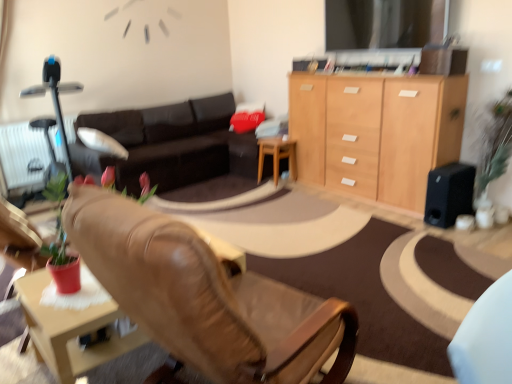
At what (x,y) coordinates should I click in order to perform the action: click on free space to the left of black matte speaker at right. Please return your answer as a coordinate pair (x, y). This screenshot has height=384, width=512. Looking at the image, I should click on (408, 218).